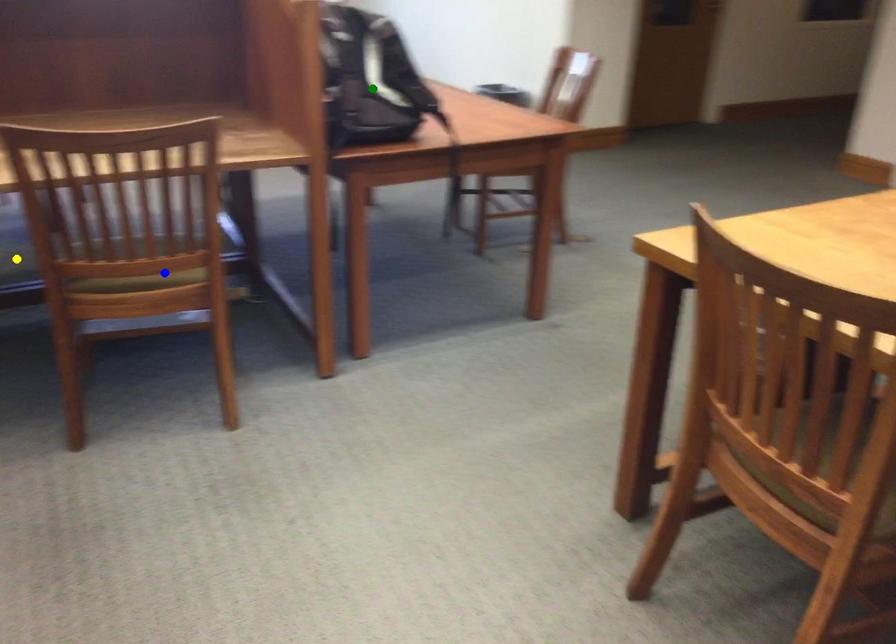
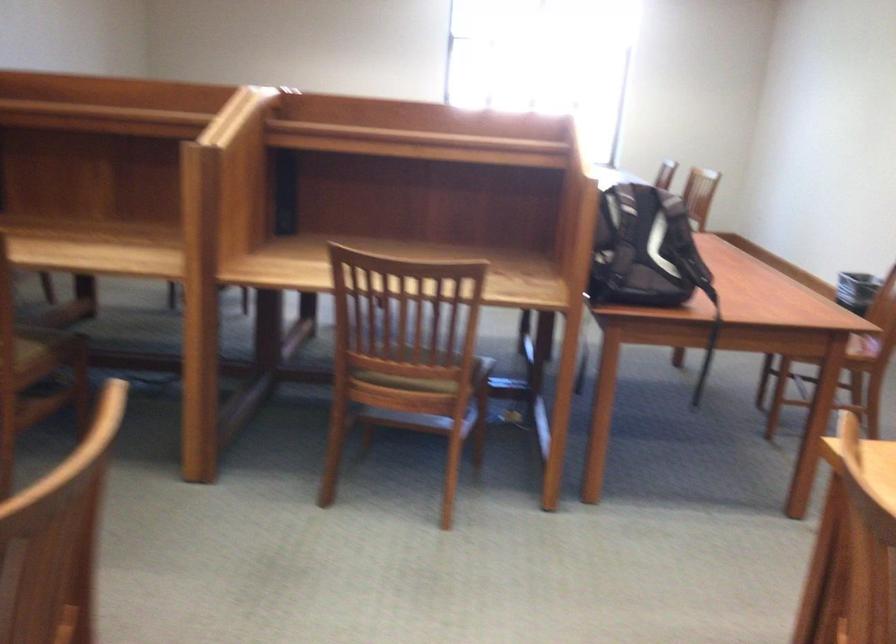
I am providing you with two images of the same scene from different viewpoints. Three points are marked in image1. Which point corresponds to a part or object that is occluded in image2?In image1, three points are marked. Which of them correspond to a part or object that is occluded in image2?Among the three points shown in image1, which one corresponds to a part or object that is no longer visible due to occlusion in image2?

yellow point